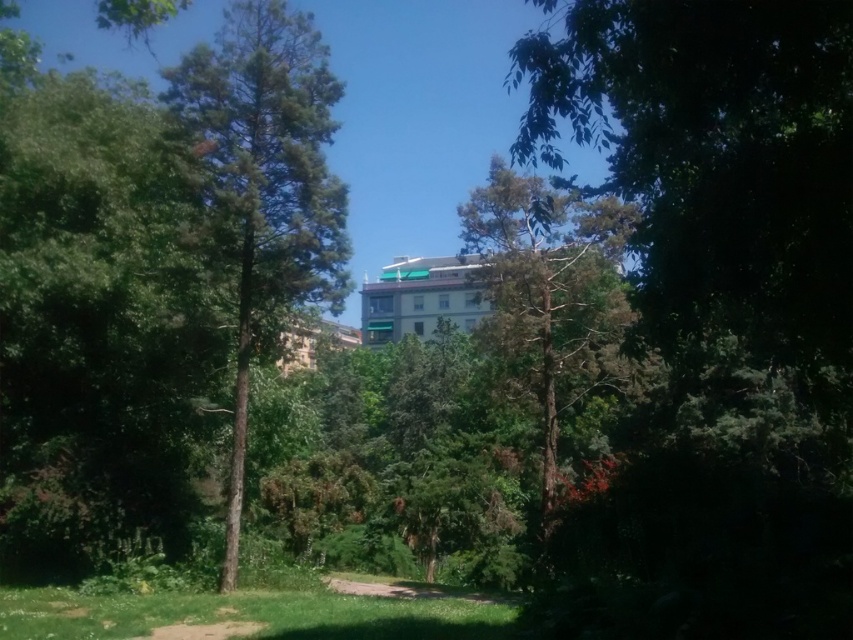
Who is positioned more to the left, green leafy tree at center or green textured tree at center?

green leafy tree at center is more to the left.

You are a GUI agent. You are given a task and a screenshot of the screen. Output one action in this format:
    pyautogui.click(x=<x>, y=<y>)
    Task: Click on the green leafy tree at center
    This screenshot has height=640, width=853.
    Given the screenshot: What is the action you would take?
    pyautogui.click(x=265, y=182)